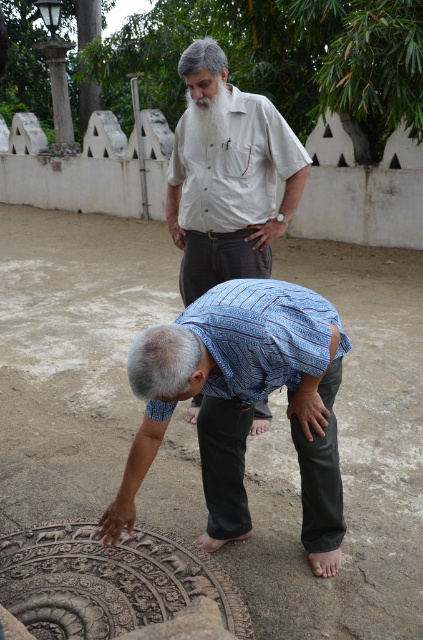
Question: Considering the relative positions of carved stone manhole cover at lower left and white cotton shirt at center in the image provided, where is carved stone manhole cover at lower left located with respect to white cotton shirt at center?

Choices:
 (A) above
 (B) below

Answer: (B)

Question: Which of the following is the closest to the observer?

Choices:
 (A) white fluffy beard at upper center
 (B) blue printed shirt at lower center

Answer: (B)

Question: Which object is closer to the camera taking this photo?

Choices:
 (A) light beige cotton shirt at center
 (B) white cotton shirt at center
 (C) carved stone manhole cover at lower left

Answer: (C)

Question: Which point appears closest to the camera in this image?

Choices:
 (A) (299, 380)
 (B) (189, 116)

Answer: (A)

Question: Can you confirm if light beige cotton shirt at center is wider than white fluffy beard at upper center?

Choices:
 (A) yes
 (B) no

Answer: (A)

Question: From the image, what is the correct spatial relationship of blue printed shirt at lower center in relation to light beige cotton shirt at center?

Choices:
 (A) left
 (B) right

Answer: (B)